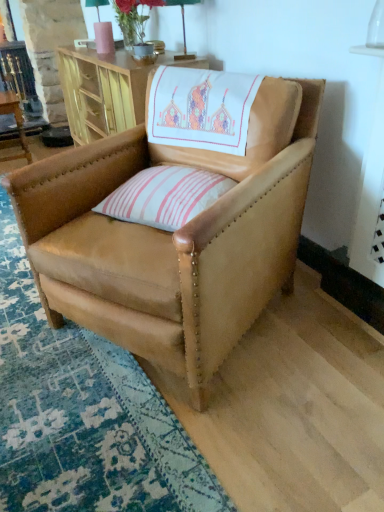
Question: From a real-world perspective, is wooden cabinet at upper center, the 1th table when ordered from right to left, positioned above or below matte pink vase at upper center?

Choices:
 (A) above
 (B) below

Answer: (B)

Question: Is point click(66, 86) positioned closer to the camera than point click(119, 20)?

Choices:
 (A) farther
 (B) closer

Answer: (A)

Question: Which object is positioned closest to the wooden cabinet at upper center, which is the second table from left to right?

Choices:
 (A) matte pink vase at upper center
 (B) tan leather chair at center
 (C) wooden table at left, the 1th table from the left
 (D) pink striped cushion at center

Answer: (A)

Question: Which is nearer to the tan leather chair at center?

Choices:
 (A) wooden table at left, the 1th table from the left
 (B) pink striped cushion at center
 (C) wooden cabinet at upper center, which is the second table from left to right
 (D) matte pink vase at upper center

Answer: (B)